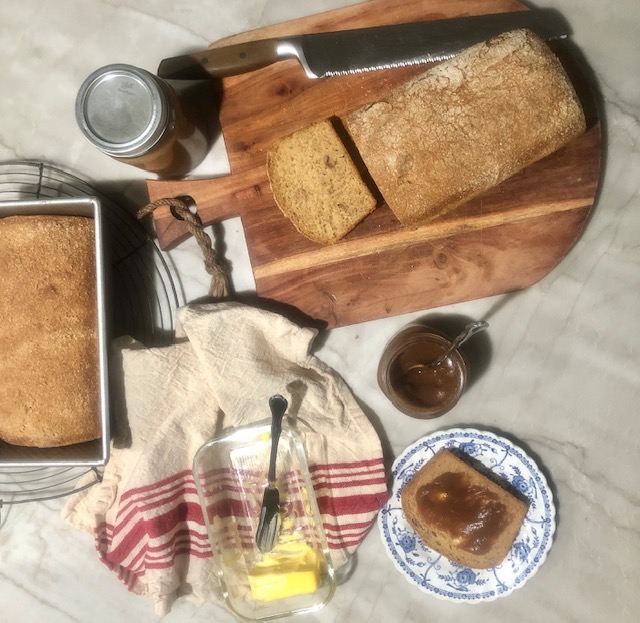
At what (x,y) coordinates should I click in order to perform the action: click on cooling rack. Please return your answer as a coordinate pair (x, y). This screenshot has width=640, height=623. Looking at the image, I should click on pyautogui.click(x=43, y=487).